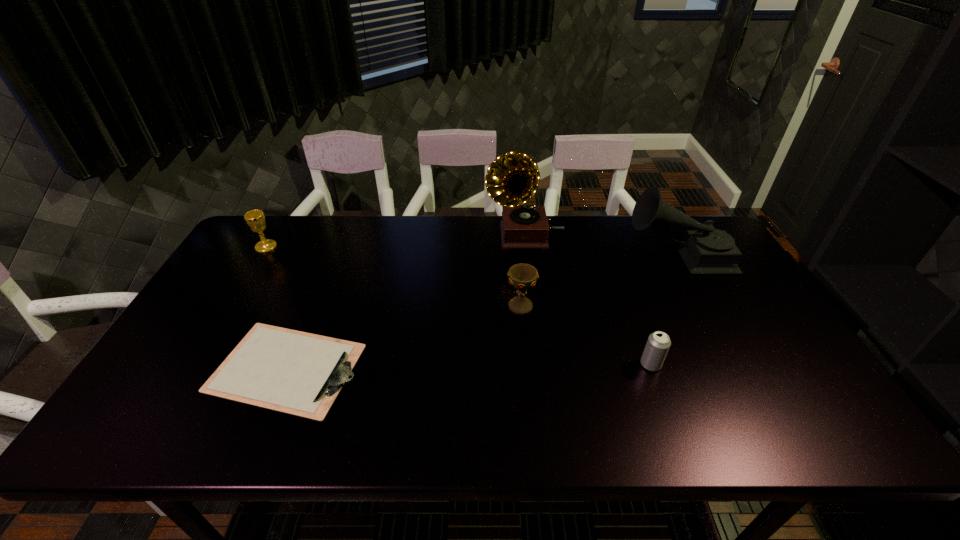
In order to click on clipboard in this screenshot , I will do `click(298, 373)`.

Find the location of a particular element. The width and height of the screenshot is (960, 540). the fifth object from right to left is located at coordinates (298, 373).

Locate an element on the screen. The image size is (960, 540). free region located from the horn of the taller phonograph_record is located at coordinates (379, 235).

I want to click on free space located from the horn of the taller phonograph_record, so click(x=405, y=235).

What are the coordinates of `free space located 0.340m from the horn of the taller phonograph_record` in the screenshot? It's located at (385, 235).

You are a GUI agent. You are given a task and a screenshot of the screen. Output one action in this format:
    pyautogui.click(x=<x>, y=<y>)
    Task: Click on the vacant space located 0.360m from the horn of the rightmost object
    The width and height of the screenshot is (960, 540).
    Given the screenshot: What is the action you would take?
    click(x=514, y=255)

The width and height of the screenshot is (960, 540). In order to click on free point located 0.380m from the horn of the rightmost object in this screenshot , I will do `click(507, 255)`.

You are a GUI agent. You are given a task and a screenshot of the screen. Output one action in this format:
    pyautogui.click(x=<x>, y=<y>)
    Task: Click on the free space located 0.380m from the horn of the rightmost object
    
    Given the screenshot: What is the action you would take?
    pyautogui.click(x=507, y=255)

The height and width of the screenshot is (540, 960). In order to click on free spot located 0.080m on the back of the farther chalice in this screenshot , I will do pos(277,227).

Locate an element on the screen. This screenshot has height=540, width=960. free space located 0.350m on the left of the nearer chalice is located at coordinates pos(382,307).